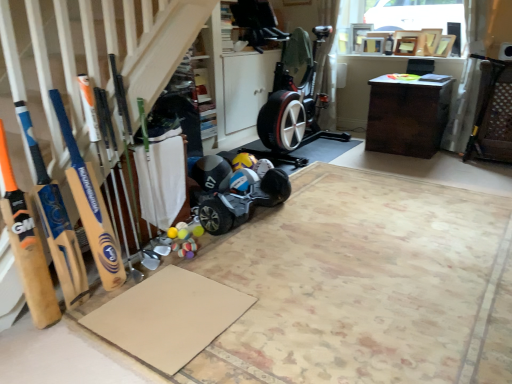
Question: Is matte black helmet at center not within wooden bat at left, which is counted as the second baseball bat, starting from the left?

Choices:
 (A) yes
 (B) no

Answer: (A)

Question: From a real-world perspective, is matte black helmet at center on top of wooden bat at left, which is counted as the second baseball bat, starting from the left?

Choices:
 (A) yes
 (B) no

Answer: (B)

Question: Does matte black helmet at center have a lesser width compared to wooden bat at left, placed as the first baseball bat when sorted from right to left?

Choices:
 (A) no
 (B) yes

Answer: (A)

Question: Does matte black helmet at center have a lesser height compared to wooden bat at left, which is counted as the second baseball bat, starting from the left?

Choices:
 (A) yes
 (B) no

Answer: (A)

Question: Considering the relative sizes of matte black helmet at center and wooden bat at left, placed as the first baseball bat when sorted from right to left, in the image provided, is matte black helmet at center taller than wooden bat at left, placed as the first baseball bat when sorted from right to left,?

Choices:
 (A) yes
 (B) no

Answer: (B)

Question: In terms of size, does black rubber baby carriage at center appear bigger or smaller than matte black helmet at center?

Choices:
 (A) small
 (B) big

Answer: (B)

Question: Do you think black rubber baby carriage at center is within matte black helmet at center, or outside of it?

Choices:
 (A) outside
 (B) inside

Answer: (A)

Question: Does point (234, 165) appear closer or farther from the camera than point (201, 168)?

Choices:
 (A) farther
 (B) closer

Answer: (A)

Question: From their relative heights in the image, would you say black rubber baby carriage at center is taller or shorter than matte black helmet at center?

Choices:
 (A) short
 (B) tall

Answer: (B)

Question: Choose the correct answer: Is black rubber baby carriage at center inside wooden bat at left, placed as the first baseball bat when sorted from right to left, or outside it?

Choices:
 (A) inside
 (B) outside

Answer: (B)

Question: Is black rubber baby carriage at center bigger or smaller than wooden bat at left, which is counted as the second baseball bat, starting from the left?

Choices:
 (A) big
 (B) small

Answer: (A)

Question: Is black rubber baby carriage at center wider or thinner than wooden bat at left, placed as the first baseball bat when sorted from right to left?

Choices:
 (A) thin
 (B) wide

Answer: (B)

Question: From the image's perspective, is black rubber baby carriage at center positioned above or below wooden bat at left, placed as the first baseball bat when sorted from right to left?

Choices:
 (A) below
 (B) above

Answer: (A)

Question: Choose the correct answer: Is beige cardboard at lower left, marked as the 2th yoga mat in a back-to-front arrangement, inside black rubber baby carriage at center or outside it?

Choices:
 (A) inside
 (B) outside

Answer: (B)

Question: Looking at their shapes, would you say beige cardboard at lower left, the 1th yoga mat positioned from the front, is wider or thinner than black rubber baby carriage at center?

Choices:
 (A) thin
 (B) wide

Answer: (B)